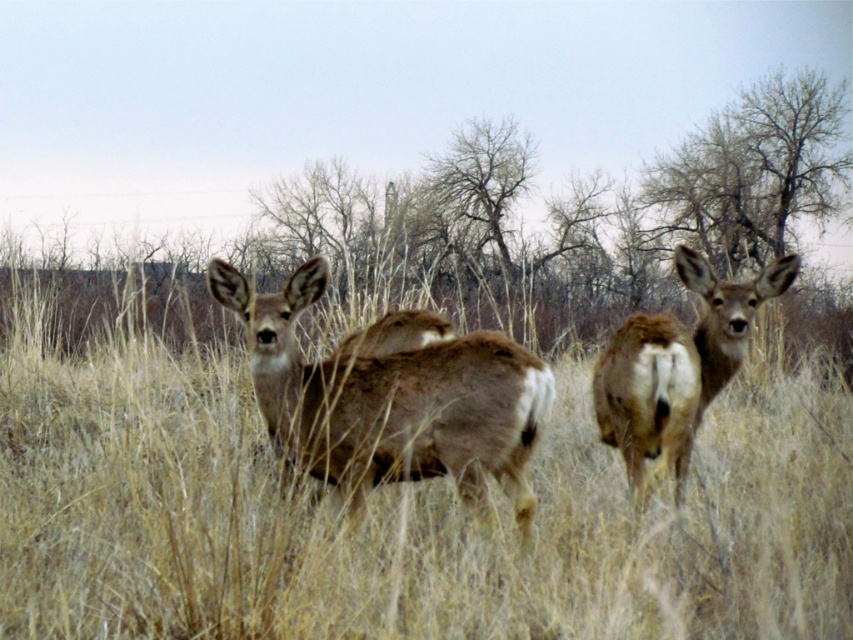
Between brown fur deer at center and brown furry deer at center, which one is positioned higher?

Positioned higher is brown furry deer at center.

Consider the image. Does brown fur deer at center have a greater height compared to brown furry deer at center?

In fact, brown fur deer at center may be shorter than brown furry deer at center.

Describe the element at coordinates (392, 401) in the screenshot. This screenshot has height=640, width=853. I see `brown fur deer at center` at that location.

You are a GUI agent. You are given a task and a screenshot of the screen. Output one action in this format:
    pyautogui.click(x=<x>, y=<y>)
    Task: Click on the brown fur deer at center
    This screenshot has height=640, width=853.
    Given the screenshot: What is the action you would take?
    pyautogui.click(x=392, y=401)

Who is more distant from viewer, (347,557) or (280,362)?

Positioned behind is point (280,362).

Can you confirm if brown textured grass at center is smaller than brown fur deer at center?

Yes, brown textured grass at center is smaller than brown fur deer at center.

I want to click on brown textured grass at center, so click(x=403, y=520).

Is brown textured grass at center taller than brown furry deer at center?

Incorrect, brown textured grass at center's height is not larger of brown furry deer at center's.

Does brown textured grass at center appear over brown furry deer at center?

Actually, brown textured grass at center is below brown furry deer at center.

This screenshot has width=853, height=640. Identify the location of brown textured grass at center. (403, 520).